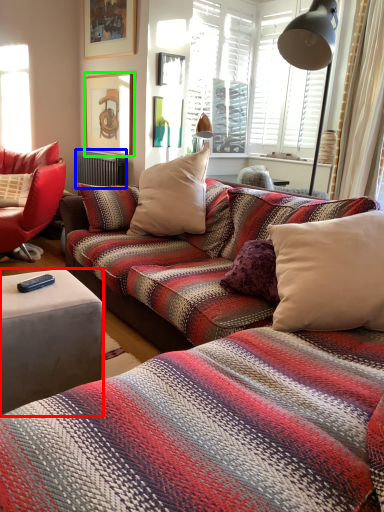
Question: Estimate the real-world distances between objects in this image. Which object is farther from studio couch (highlighted by a red box), radiator (highlighted by a blue box) or picture frame (highlighted by a green box)?

Choices:
 (A) radiator
 (B) picture frame

Answer: (B)